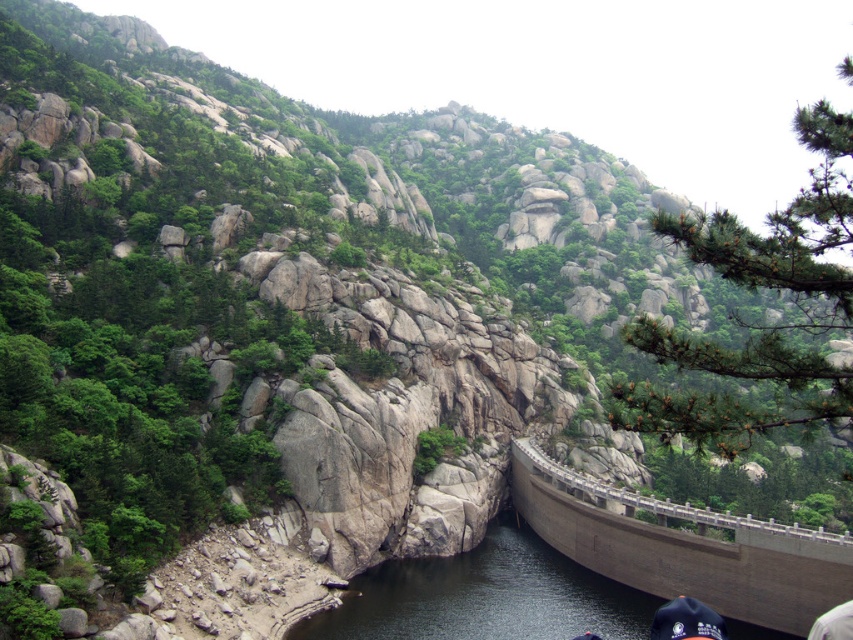
Is gray concrete dam at center to the left of dark gray concrete river at center from the viewer's perspective?

In fact, gray concrete dam at center is to the right of dark gray concrete river at center.

Which is below, gray concrete dam at center or dark gray concrete river at center?

dark gray concrete river at center

Is point (532, 506) in front of point (367, 588)?

No, it is not.

The image size is (853, 640). Find the location of `gray concrete dam at center`. gray concrete dam at center is located at coordinates (683, 547).